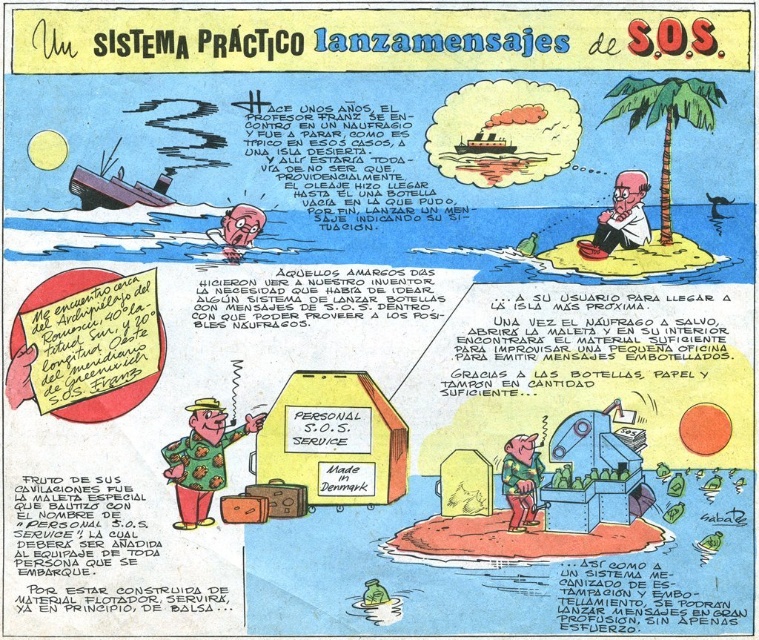
Question: Which point appears closest to the camera in this image?

Choices:
 (A) (632, 172)
 (B) (222, 467)

Answer: (B)

Question: Which point appears farthest from the camera in this image?

Choices:
 (A) (583, 257)
 (B) (172, 524)

Answer: (A)

Question: Which point appears closest to the camera in this image?

Choices:
 (A) (619, 218)
 (B) (222, 444)

Answer: (B)

Question: Can you confirm if polka dot fabric suitcase at center is wider than white paper at upper center?

Choices:
 (A) no
 (B) yes

Answer: (B)

Question: Can you confirm if polka dot fabric suitcase at center is thinner than white paper at upper center?

Choices:
 (A) no
 (B) yes

Answer: (A)

Question: Where is polka dot fabric suitcase at center located in relation to white paper at upper center in the image?

Choices:
 (A) right
 (B) left

Answer: (B)